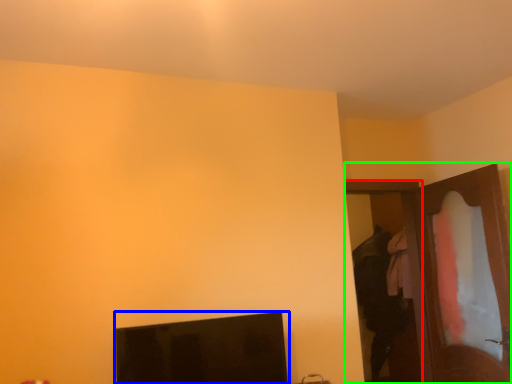
Question: Based on their relative distances, which object is nearer to door (highlighted by a red box)? Choose from computer monitor (highlighted by a blue box) and dresser (highlighted by a green box).

Choices:
 (A) computer monitor
 (B) dresser

Answer: (B)